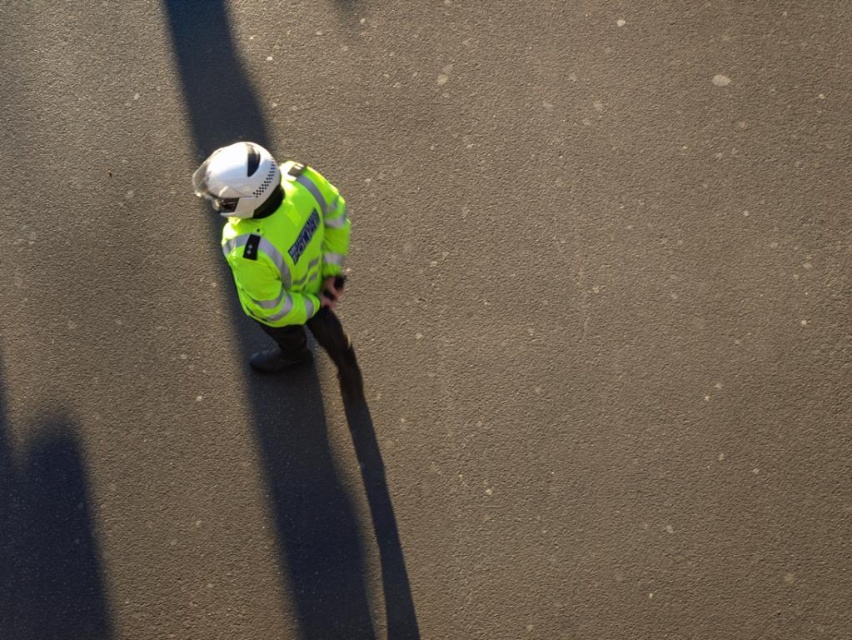
Question: Which point is farther from the camera taking this photo?

Choices:
 (A) (314, 195)
 (B) (317, 246)

Answer: (B)

Question: Can you confirm if high-visibility fabric jacket at center is bigger than high-visibility fabric safety vest at center?

Choices:
 (A) yes
 (B) no

Answer: (A)

Question: Which of the following is the closest to the observer?

Choices:
 (A) (327, 260)
 (B) (240, 282)

Answer: (B)

Question: Does high-visibility fabric jacket at center have a larger size compared to high-visibility fabric safety vest at center?

Choices:
 (A) no
 (B) yes

Answer: (B)

Question: Which point is closer to the camera?

Choices:
 (A) (268, 182)
 (B) (323, 211)

Answer: (A)

Question: Where is high-visibility fabric jacket at center located in relation to high-visibility fabric safety vest at center in the image?

Choices:
 (A) right
 (B) left

Answer: (B)